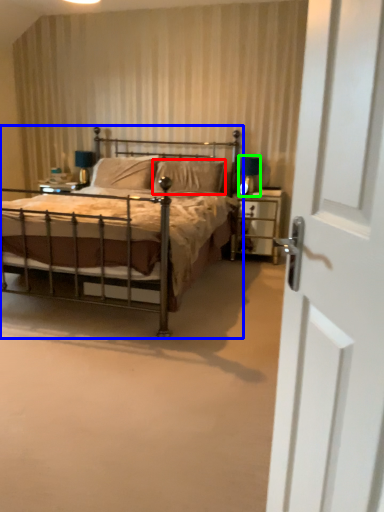
Question: Which is farther away from pillow (highlighted by a red box)? bed (highlighted by a blue box) or table lamp (highlighted by a green box)?

Choices:
 (A) bed
 (B) table lamp

Answer: (A)